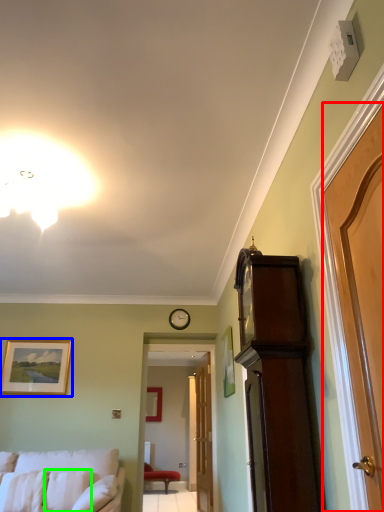
Question: Considering the real-world distances, which object is closest to door (highlighted by a red box)? picture frame (highlighted by a blue box) or pillow (highlighted by a green box).

Choices:
 (A) picture frame
 (B) pillow

Answer: (B)